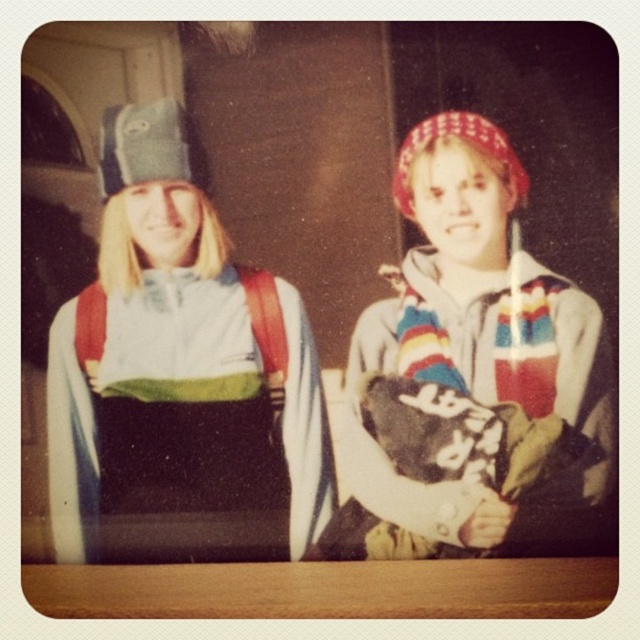
Question: Does matte blue ski jacket at left appear over matte white and green jacket at center?

Choices:
 (A) yes
 (B) no

Answer: (A)

Question: Based on their relative distances, which object is farther from the matte white and green jacket at center?

Choices:
 (A) matte multicolored hoodie at center
 (B) matte blue ski jacket at left

Answer: (A)

Question: Does matte blue ski jacket at left appear on the right side of matte multicolored hoodie at center?

Choices:
 (A) no
 (B) yes

Answer: (A)

Question: Can you confirm if matte blue ski jacket at left is positioned to the left of matte multicolored hoodie at center?

Choices:
 (A) no
 (B) yes

Answer: (B)

Question: Estimate the real-world distances between objects in this image. Which object is farther from the matte blue ski jacket at left?

Choices:
 (A) matte multicolored hoodie at center
 (B) matte white and green jacket at center

Answer: (A)

Question: Which object appears farthest from the camera in this image?

Choices:
 (A) matte multicolored hoodie at center
 (B) matte blue ski jacket at left

Answer: (B)